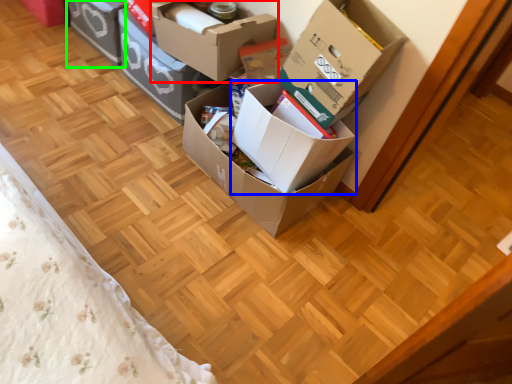
Question: Based on their relative distances, which object is nearer to box (highlighted by a red box)? Choose from box (highlighted by a blue box) and box (highlighted by a green box).

Choices:
 (A) box
 (B) box

Answer: (A)